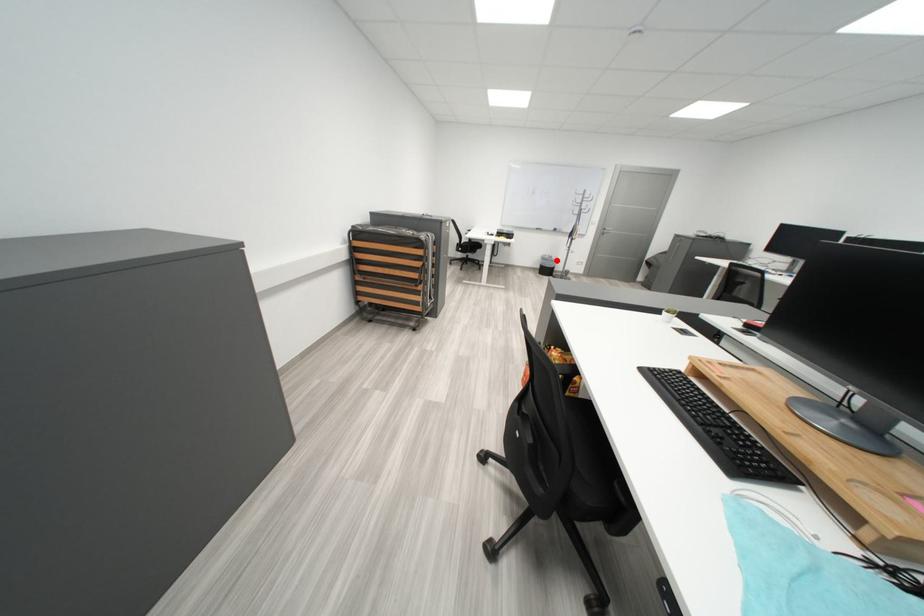
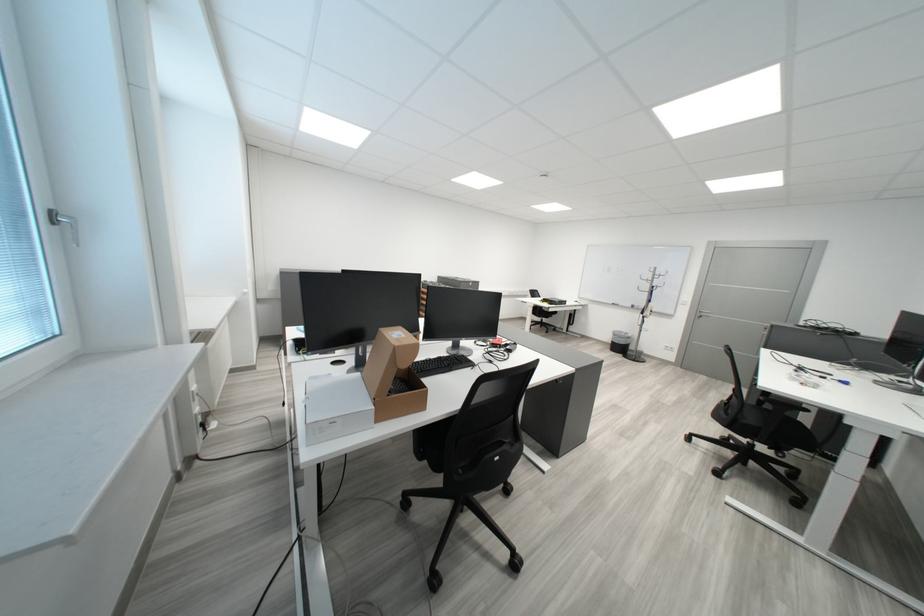
Find the pixel in the second image that matches the highlighted location in the first image.

(627, 336)